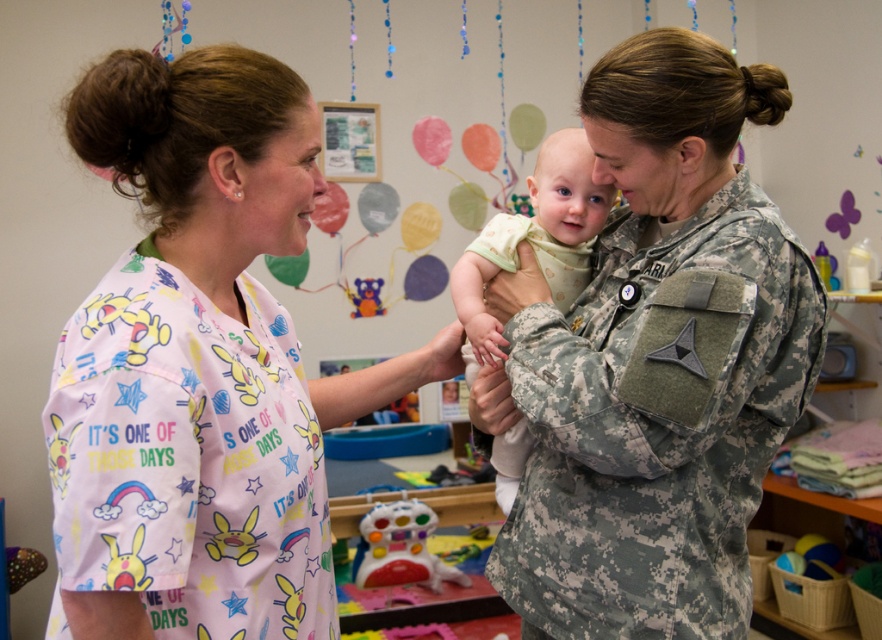
Between point (274, 630) and point (311, 595), which one is positioned in front?

Positioned in front is point (274, 630).

Which of these two, pink fabric shirt at left or pink fabric scrub top at left, stands shorter?

With less height is pink fabric scrub top at left.

Is point (126, 416) more distant than point (161, 547)?

Yes, it is.

Find the location of a particular element. pink fabric shirt at left is located at coordinates (200, 365).

Locate an element on the screen. pink fabric scrub top at left is located at coordinates (187, 460).

Does pink fabric scrub top at left have a greater height compared to multicolored plastic toy at center?

Indeed, pink fabric scrub top at left has a greater height compared to multicolored plastic toy at center.

Is point (118, 520) behind point (387, 541)?

No.

Locate an element on the screen. pink fabric scrub top at left is located at coordinates [187, 460].

In the scene shown: Does camouflage fabric uniform at center have a lesser width compared to multicolored plastic toy at center?

No, camouflage fabric uniform at center is not thinner than multicolored plastic toy at center.

Where is `camouflage fabric uniform at center`? The height and width of the screenshot is (640, 882). camouflage fabric uniform at center is located at coordinates [654, 433].